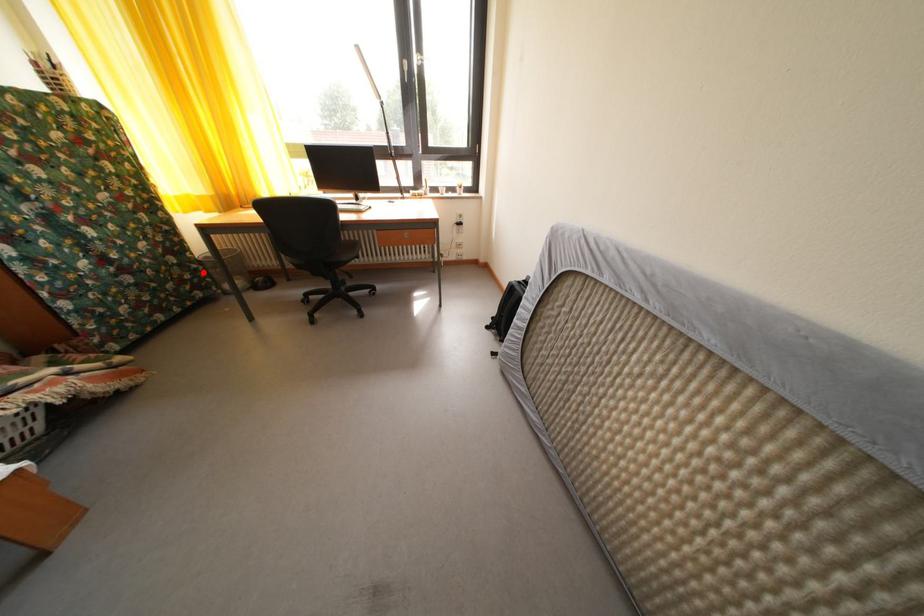
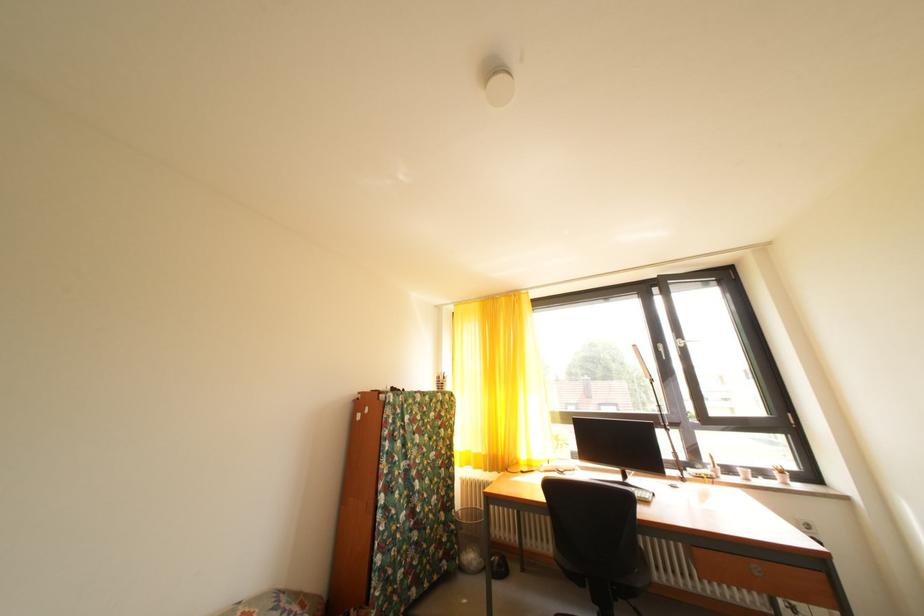
Where in the second image is the point corresponding to the highlighted location from the first image?

(462, 533)